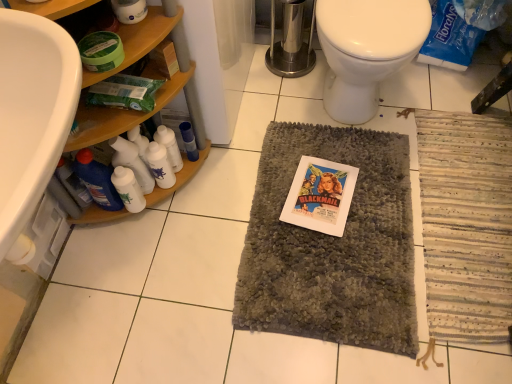
I want to click on free space to the left of gray shaggy mat at center, so click(x=174, y=257).